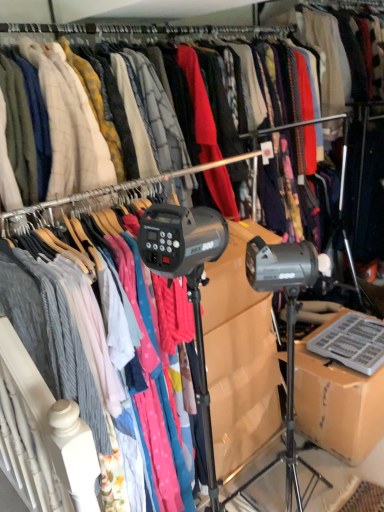
Question: Do you think brown cardboard box at lower right is within matte gray sweater at center, or outside of it?

Choices:
 (A) inside
 (B) outside

Answer: (B)

Question: From a real-world perspective, is brown cardboard box at lower right physically located above or below matte gray sweater at center?

Choices:
 (A) above
 (B) below

Answer: (B)

Question: Is point (340, 315) positioned closer to the camera than point (52, 364)?

Choices:
 (A) farther
 (B) closer

Answer: (A)

Question: Considering the relative positions of matte gray sweater at center and brown cardboard box at lower right in the image provided, is matte gray sweater at center to the left or to the right of brown cardboard box at lower right?

Choices:
 (A) left
 (B) right

Answer: (A)

Question: Is matte gray sweater at center wider or thinner than brown cardboard box at lower right?

Choices:
 (A) thin
 (B) wide

Answer: (B)

Question: From the image's perspective, is matte gray sweater at center located above or below brown cardboard box at lower right?

Choices:
 (A) below
 (B) above

Answer: (B)

Question: Do you think matte gray sweater at center is within brown cardboard box at lower right, or outside of it?

Choices:
 (A) outside
 (B) inside

Answer: (A)